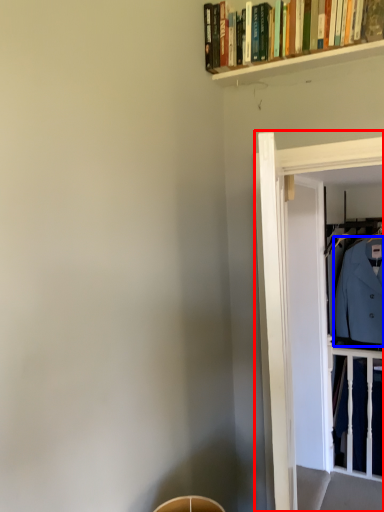
Question: Which object appears closest to the camera in this image, glass door (highlighted by a red box) or dress shirt (highlighted by a blue box)?

Choices:
 (A) glass door
 (B) dress shirt

Answer: (A)